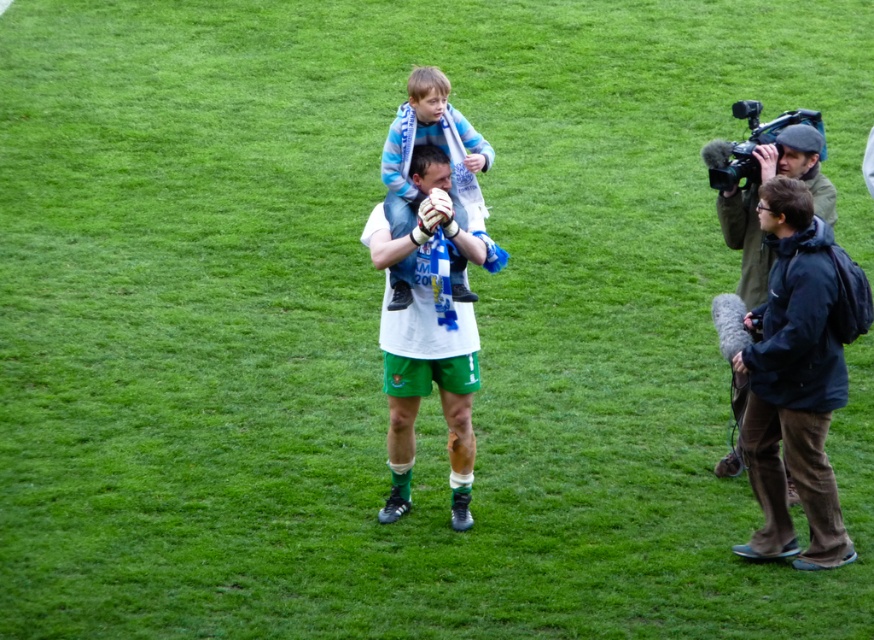
Question: Can you confirm if white fabric shirt at center is smaller than dark green jacket at right?

Choices:
 (A) no
 (B) yes

Answer: (A)

Question: Which object is farther from the camera taking this photo?

Choices:
 (A) blue striped scarf at center
 (B) white fabric shirt at center

Answer: (A)

Question: Is white fabric shirt at center further to the viewer compared to blue striped scarf at center?

Choices:
 (A) no
 (B) yes

Answer: (A)

Question: Considering the real-world distances, which object is farthest from the white fabric shirt at center?

Choices:
 (A) dark green jacket at right
 (B) blue striped scarf at center

Answer: (A)

Question: Which object is positioned closest to the blue striped scarf at center?

Choices:
 (A) white fabric shirt at center
 (B) dark green jacket at right

Answer: (A)

Question: Is white fabric shirt at center to the left of blue striped scarf at center from the viewer's perspective?

Choices:
 (A) yes
 (B) no

Answer: (B)